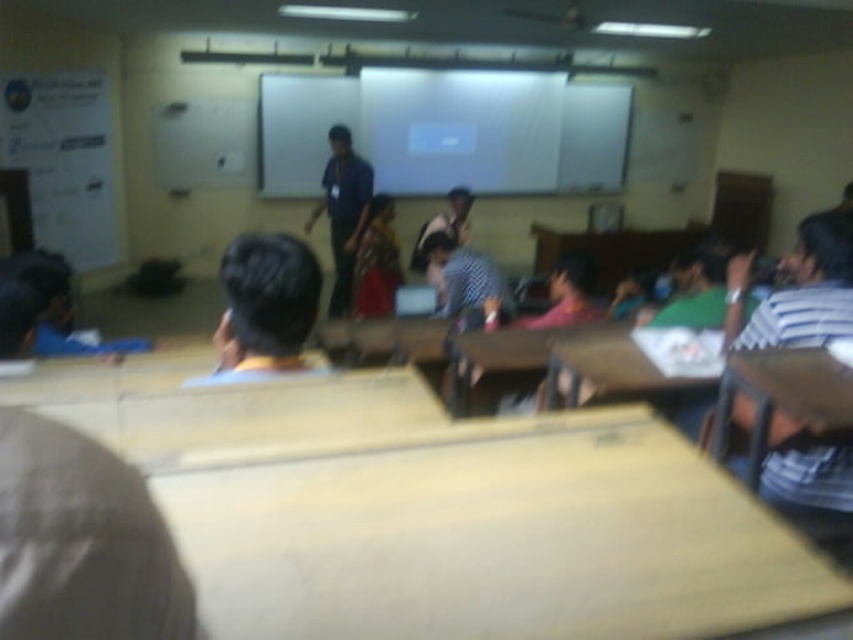
In the scene shown: Which is more to the right, white striped shirt at right or blue shirt at center?

From the viewer's perspective, white striped shirt at right appears more on the right side.

Who is taller, white striped shirt at right or blue shirt at center?

Standing taller between the two is blue shirt at center.

Between point (786, 468) and point (354, 218), which one is positioned behind?

The point (354, 218) is behind.

The image size is (853, 640). In order to click on white striped shirt at right in this screenshot , I will do `click(799, 289)`.

Which is below, white striped shirt at right or checkered fabric shirt at center?

white striped shirt at right is below.

What do you see at coordinates (799, 289) in the screenshot? I see `white striped shirt at right` at bounding box center [799, 289].

I want to click on white striped shirt at right, so click(799, 289).

Can you confirm if blue shirt at center is smaller than checkered fabric shirt at center?

Correct, blue shirt at center occupies less space than checkered fabric shirt at center.

Which is below, blue shirt at center or checkered fabric shirt at center?

Positioned lower is checkered fabric shirt at center.

Is point (335, 124) less distant than point (438, 244)?

No, it is behind (438, 244).

Where is `blue shirt at center`? The width and height of the screenshot is (853, 640). blue shirt at center is located at coordinates (343, 211).